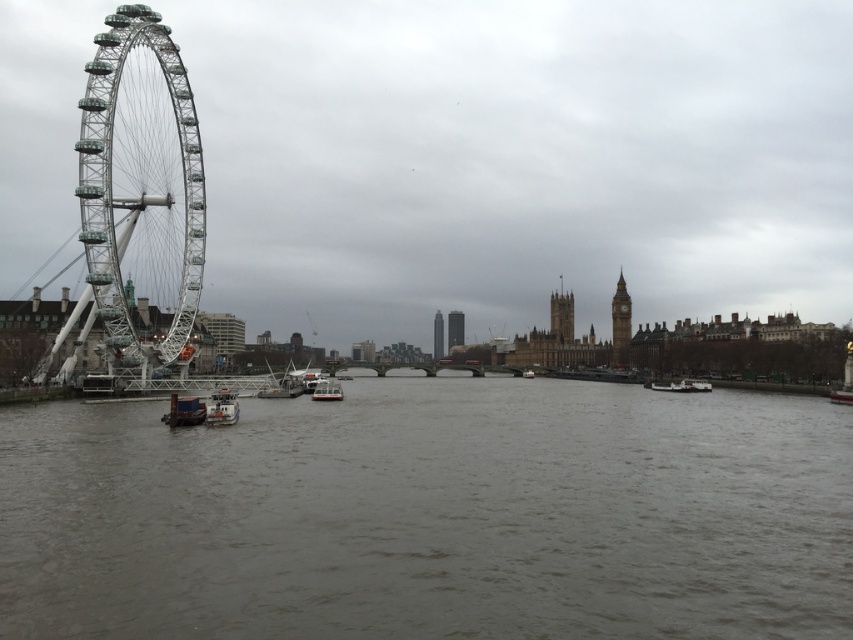
Question: Is gray matte water at center positioned at the back of golden stone clock tower at center?

Choices:
 (A) no
 (B) yes

Answer: (A)

Question: Does metallic glass ferris wheel at left appear on the left side of golden stone clock tower at center?

Choices:
 (A) yes
 (B) no

Answer: (A)

Question: Among these points, which one is farthest from the camera?

Choices:
 (A) (451, 333)
 (B) (659, 381)

Answer: (A)

Question: Which of the following is the closest to the observer?

Choices:
 (A) glassy steel skyscraper at center
 (B) wooden boat at left
 (C) golden stone clock tower at center
 (D) gray matte water at center

Answer: (D)

Question: Among these objects, which one is farthest from the camera?

Choices:
 (A) gray matte water at center
 (B) metallic silver boat at center

Answer: (B)

Question: Is metallic glass ferris wheel at left to the right of metallic silver boat at center from the viewer's perspective?

Choices:
 (A) no
 (B) yes

Answer: (A)